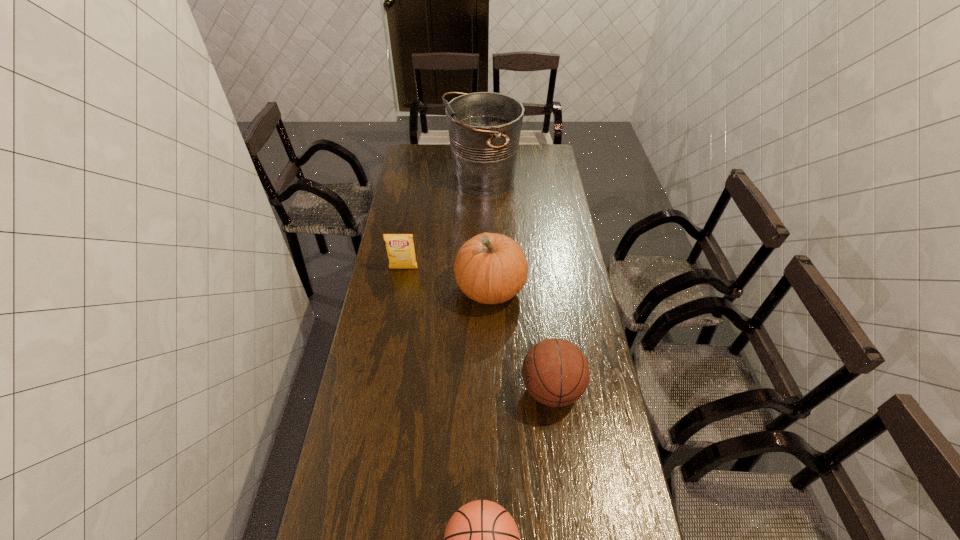
Where is `the farthest object`? This screenshot has width=960, height=540. the farthest object is located at coordinates (484, 128).

The width and height of the screenshot is (960, 540). What are the coordinates of `the tallest object` in the screenshot? It's located at (484, 128).

Where is `the second tallest object`? The width and height of the screenshot is (960, 540). the second tallest object is located at coordinates (490, 268).

Locate an element on the screen. Image resolution: width=960 pixels, height=540 pixels. the farther basketball is located at coordinates (555, 372).

Find the location of a particular element. The height and width of the screenshot is (540, 960). the fourth farthest object is located at coordinates (555, 372).

Locate an element on the screen. the leftmost object is located at coordinates (400, 248).

This screenshot has width=960, height=540. Find the location of `free space located 0.240m on the front of the bucket`. free space located 0.240m on the front of the bucket is located at coordinates (483, 239).

I want to click on vacant space located 0.280m on the stem of the second tallest object, so click(x=380, y=289).

Locate an element on the screen. The width and height of the screenshot is (960, 540). free space located 0.300m on the stem of the second tallest object is located at coordinates (375, 289).

This screenshot has width=960, height=540. What are the coordinates of `vacant space located 0.210m on the stem of the second tallest object` in the screenshot? It's located at point(399,289).